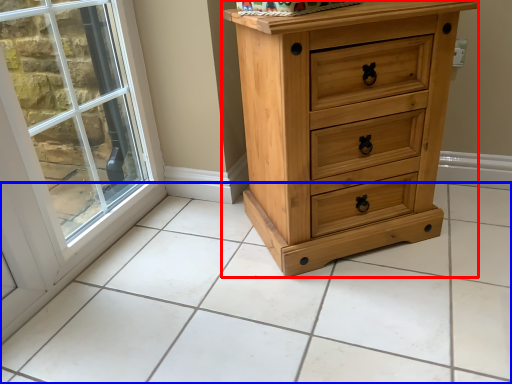
Question: Which object appears farthest to the camera in this image, chest of drawers (highlighted by a red box) or tile (highlighted by a blue box)?

Choices:
 (A) chest of drawers
 (B) tile

Answer: (A)